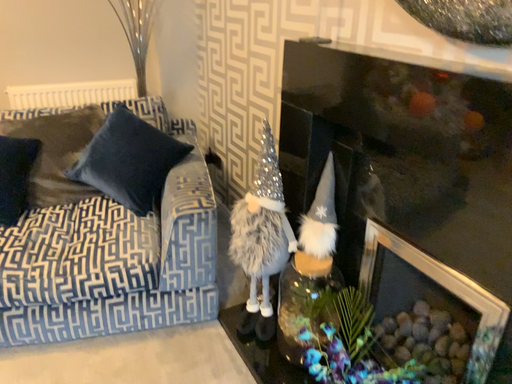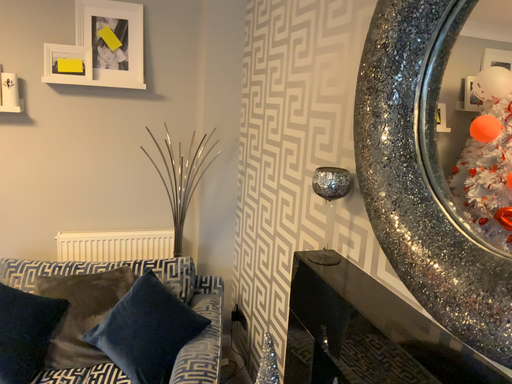
Question: Which way did the camera rotate in the video?

Choices:
 (A) rotated right
 (B) rotated left

Answer: (B)